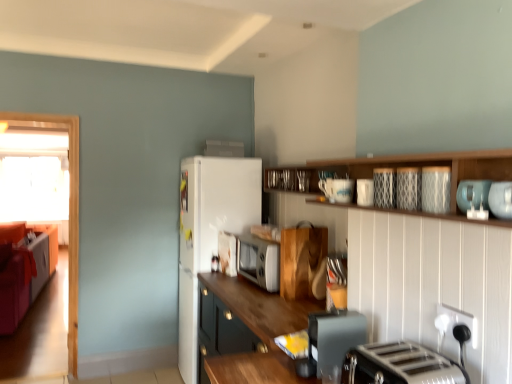
Locate an element on the screen. The height and width of the screenshot is (384, 512). free space in front of wooden cutting board at center, the second cabinetry when ordered from front to back is located at coordinates (301, 304).